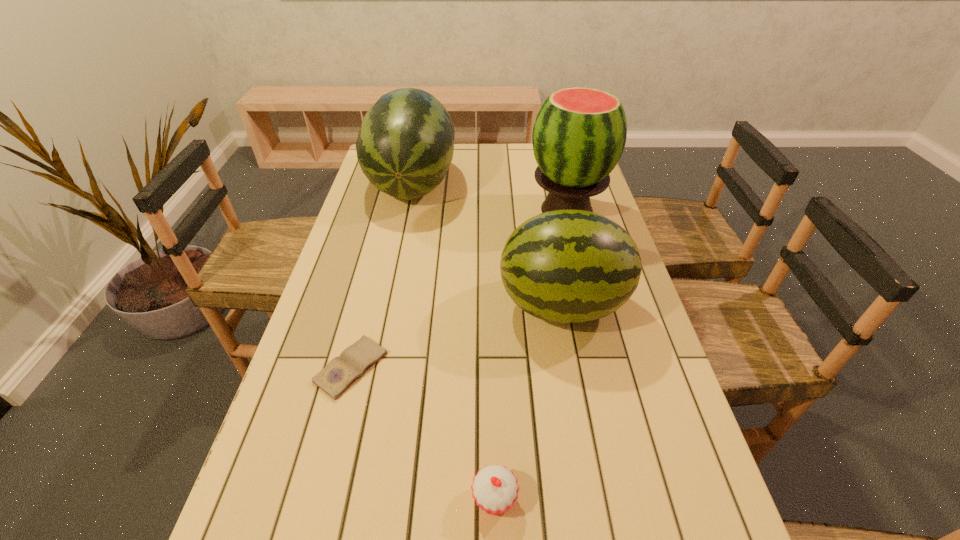
This screenshot has height=540, width=960. Find the location of `blank region between the fourth shortest object and the shortest watermelon`. blank region between the fourth shortest object and the shortest watermelon is located at coordinates (488, 245).

Where is `vacant space that's between the second shortest watermelon and the diary`? Image resolution: width=960 pixels, height=540 pixels. vacant space that's between the second shortest watermelon and the diary is located at coordinates (381, 275).

Locate an element on the screen. The height and width of the screenshot is (540, 960). vacant area that lies between the second tallest object and the second shortest object is located at coordinates (453, 341).

The image size is (960, 540). Find the location of `vacant region between the shortest object and the second shortest watermelon`. vacant region between the shortest object and the second shortest watermelon is located at coordinates 381,275.

What are the coordinates of `object identified as the fourth closest to the cupcake` in the screenshot? It's located at (405, 145).

This screenshot has width=960, height=540. I want to click on object that is the third closest one to the diary, so click(405, 145).

Point out which watermelon is positioned as the third nearest to the cupcake. Please provide its 2D coordinates. Your answer should be formatted as a tuple, i.e. [(x, y)], where the tuple contains the x and y coordinates of a point satisfying the conditions above.

[(405, 145)]

Locate an element on the screen. watermelon that is the second closest to the second tallest object is located at coordinates (564, 266).

You are a GUI agent. You are given a task and a screenshot of the screen. Output one action in this format:
    pyautogui.click(x=<x>, y=<y>)
    Task: Click on the free point that satisfies the following two spatial constraints: 1. on the front side of the shortest object; 2. on the right side of the fourth tallest object
    The image size is (960, 540).
    Given the screenshot: What is the action you would take?
    pyautogui.click(x=318, y=498)